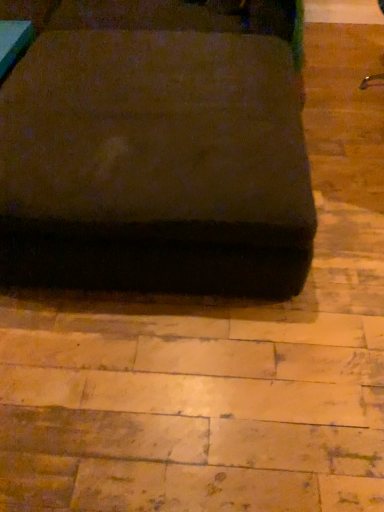
This screenshot has height=512, width=384. I want to click on free space in front of brown fabric ottoman at center, so click(174, 381).